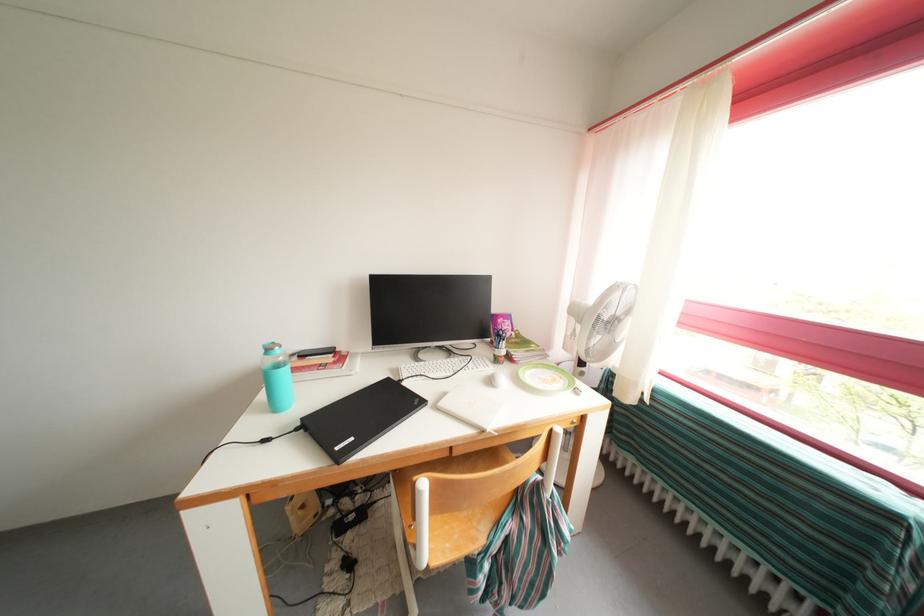
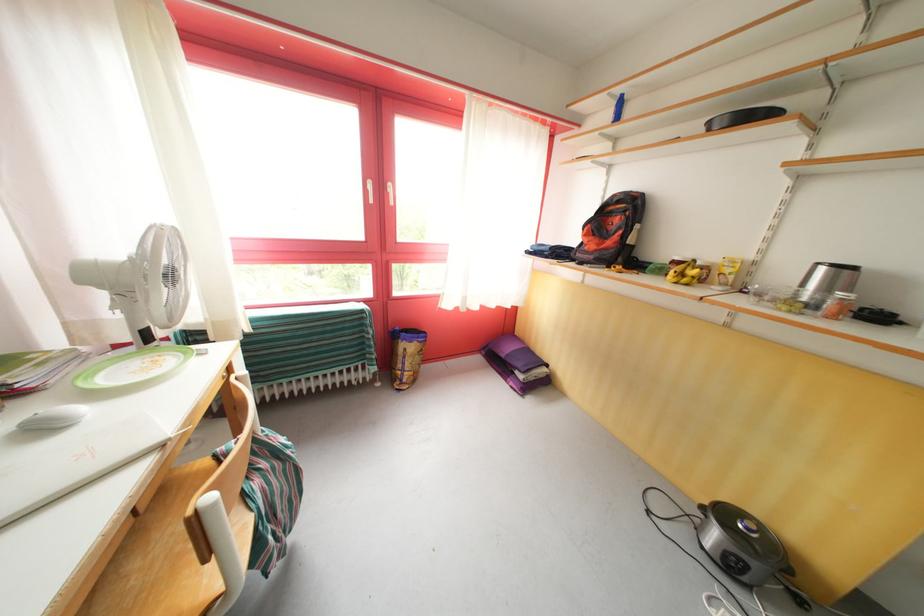
Consider the image. The images are taken continuously from a first-person perspective. In which direction is your viewpoint rotating?

→ The camera rotated toward right-down.